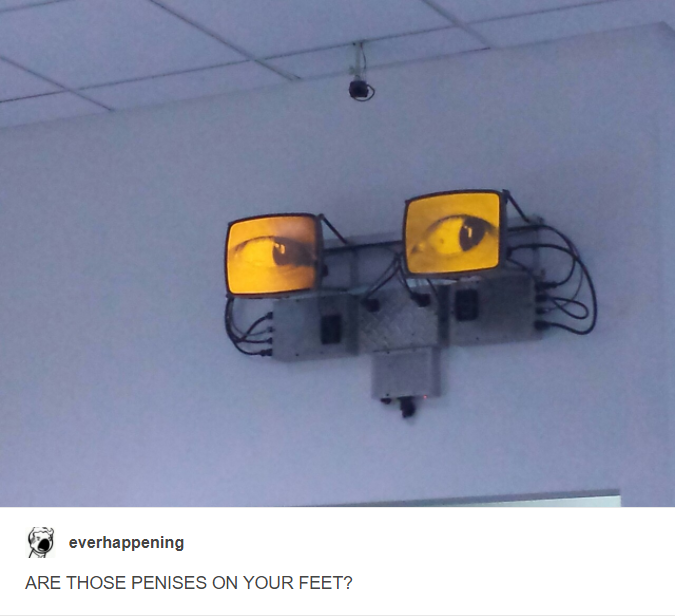
Where is `ceiling`? The image size is (675, 616). ceiling is located at coordinates (146, 31).